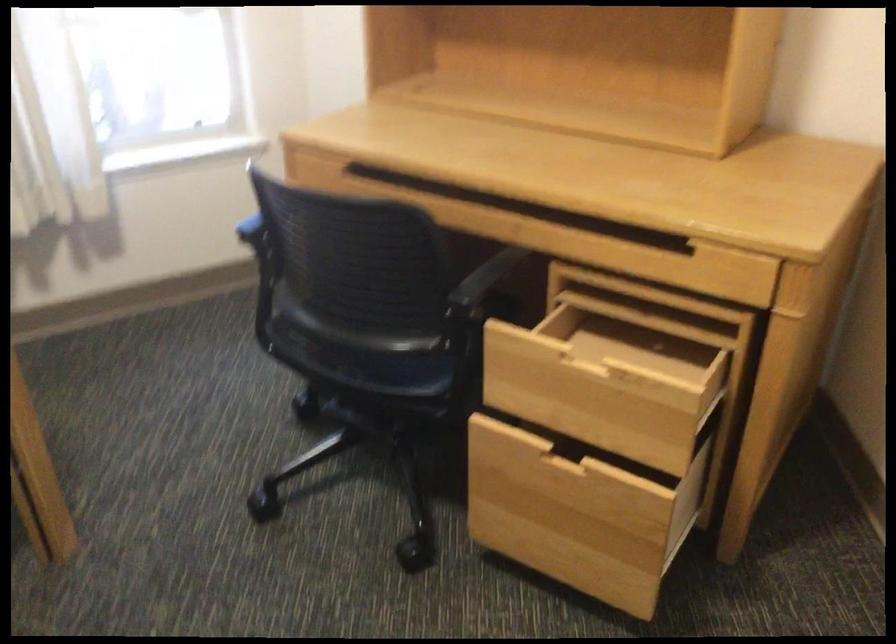
At what (x,y) coordinates should I click in order to perform the action: click on long drawer handle. Please return your answer as a coordinate pair (x, y). The height and width of the screenshot is (644, 896). Looking at the image, I should click on (558, 450).